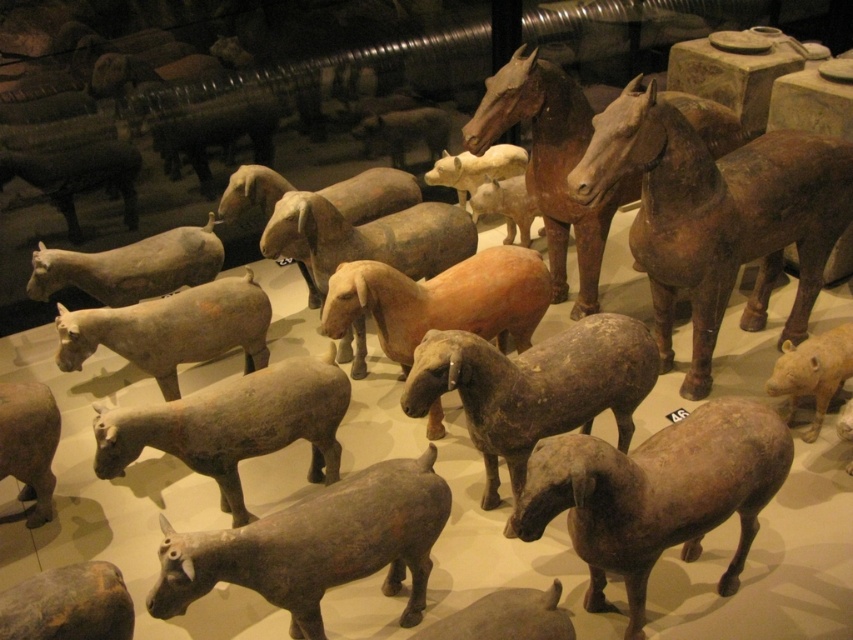
Which of these two, matte clay sheep at center or matte gray cow at lower left, stands taller?

matte clay sheep at center

Is point (106, 426) in front of point (83, 573)?

No, (106, 426) is further to viewer.

The image size is (853, 640). I want to click on matte clay sheep at center, so click(x=234, y=426).

Locate an element on the screen. This screenshot has width=853, height=640. matte clay sheep at center is located at coordinates (234, 426).

Describe the element at coordinates (656, 493) in the screenshot. I see `matte gray sheep at center` at that location.

You are a GUI agent. You are given a task and a screenshot of the screen. Output one action in this format:
    pyautogui.click(x=<x>, y=<y>)
    Task: Click on the matte gray sheep at center
    
    Given the screenshot: What is the action you would take?
    pyautogui.click(x=656, y=493)

Does brown matte horse at center-right lie behind matte brown piglet at lower right?

No.

Can you confirm if brown matte horse at center-right is thinner than matte brown piglet at lower right?

In fact, brown matte horse at center-right might be wider than matte brown piglet at lower right.

You are a GUI agent. You are given a task and a screenshot of the screen. Output one action in this format:
    pyautogui.click(x=<x>, y=<y>)
    Task: Click on the brown matte horse at center-right
    The image size is (853, 640).
    Given the screenshot: What is the action you would take?
    pyautogui.click(x=717, y=216)

Locate an element on the screen. Image resolution: width=853 pixels, height=640 pixels. brown matte horse at center-right is located at coordinates (717, 216).